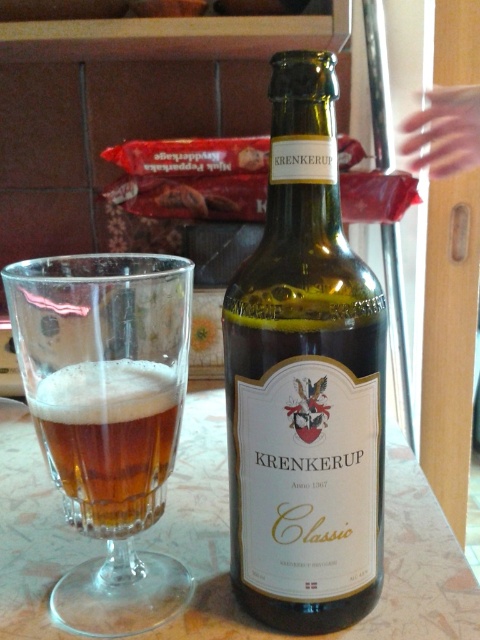
Question: Is the position of green glass bottle at center less distant than that of transparent glass at center?

Choices:
 (A) yes
 (B) no

Answer: (A)

Question: Is the position of green glass bottle at center more distant than that of transparent glass at center?

Choices:
 (A) no
 (B) yes

Answer: (A)

Question: Which point is farther to the camera?

Choices:
 (A) transparent glass at center
 (B) amber glass beer at center
 (C) green glass bottle at center

Answer: (B)

Question: Which point is closer to the camera taking this photo?

Choices:
 (A) click(x=273, y=316)
 (B) click(x=107, y=294)
 (C) click(x=46, y=442)

Answer: (A)

Question: From the image, what is the correct spatial relationship of green glass bottle at center in relation to amber glass beer at center?

Choices:
 (A) right
 (B) left

Answer: (A)

Question: Which point appears farthest from the camera in this image?

Choices:
 (A) (86, 316)
 (B) (90, 380)

Answer: (B)